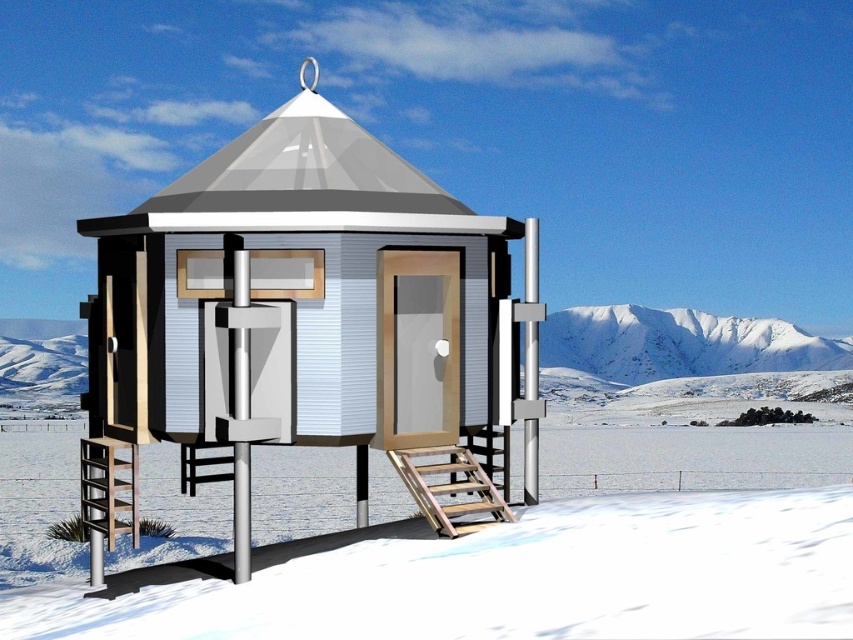
Question: Does white matte cabin at center lie behind wooden at lower right?

Choices:
 (A) no
 (B) yes

Answer: (A)

Question: Is white snow-covered mountain at upper right below white snow-covered mountain at left?

Choices:
 (A) no
 (B) yes

Answer: (A)

Question: Which point is farther from the camera taking this photo?

Choices:
 (A) (260, 131)
 (B) (57, 344)
 (C) (503, 598)
 (D) (445, 481)

Answer: (B)

Question: Which of the following is the farthest from the observer?

Choices:
 (A) (791, 358)
 (B) (408, 577)

Answer: (A)

Question: Among these points, which one is nearest to the camera?

Choices:
 (A) (234, 394)
 (B) (744, 324)

Answer: (A)

Question: Does white matte cabin at center appear on the right side of white powdery snow at lower center?

Choices:
 (A) no
 (B) yes

Answer: (A)